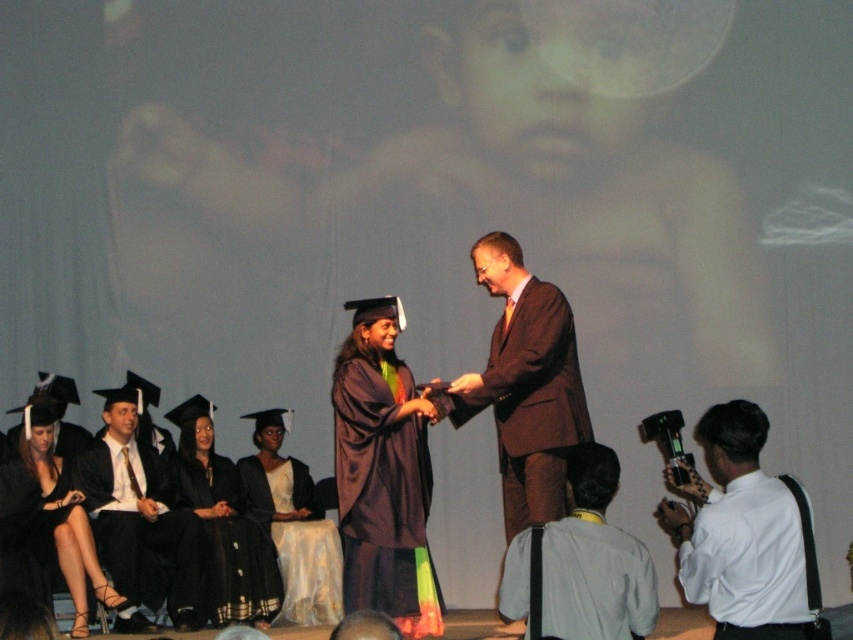
Question: Is white shirt at lower right smaller than black satin gown at lower center?

Choices:
 (A) no
 (B) yes

Answer: (B)

Question: Does white shirt at lower right come behind brown suit at center?

Choices:
 (A) no
 (B) yes

Answer: (A)

Question: Which object appears farthest from the camera in this image?

Choices:
 (A) brown suit at center
 (B) black satin gown at lower center
 (C) white shirt at lower right
 (D) black satin suit at left

Answer: (B)

Question: Among these points, which one is farthest from the camera?

Choices:
 (A) (219, 502)
 (B) (485, 236)

Answer: (A)

Question: Where is gray fabric camera at lower right located in relation to white satin gown at center in the image?

Choices:
 (A) left
 (B) right

Answer: (B)

Question: Which point is farther to the camera?

Choices:
 (A) brown suit at center
 (B) white satin gown at center
 (C) gray fabric camera at lower right

Answer: (B)